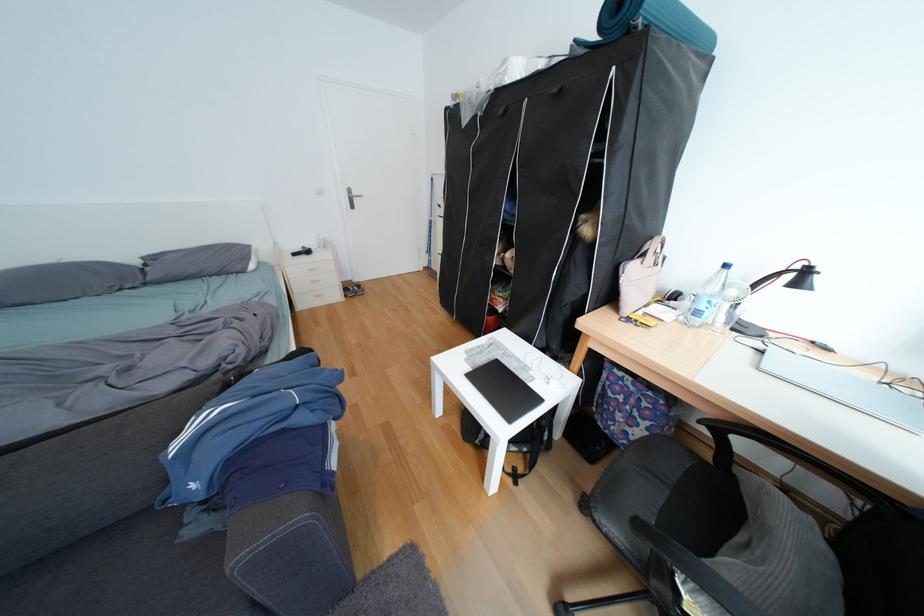
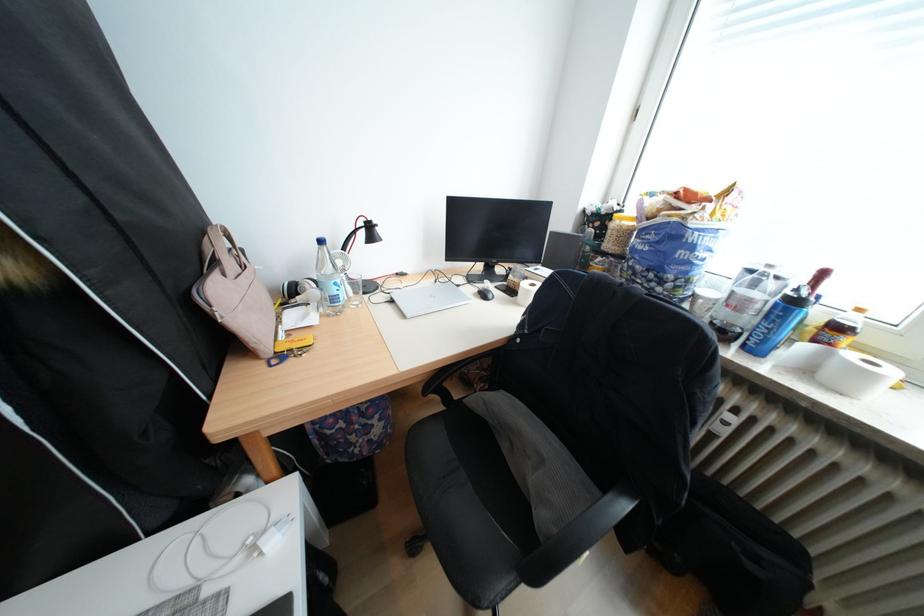
The first image is from the beginning of the video and the second image is from the end. How did the camera likely rotate when shooting the video?

The camera's rotation is toward right-down.